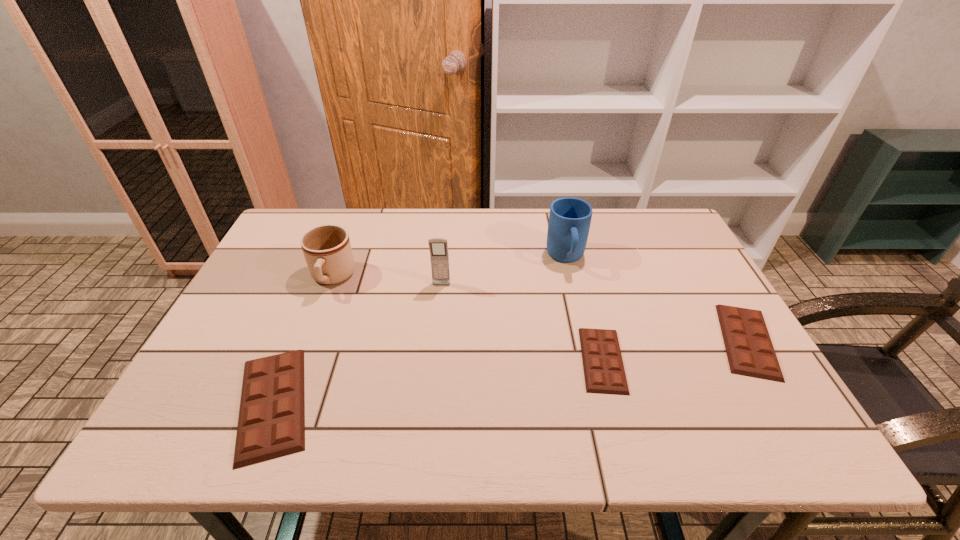
To achieve uniform spacing by inserting another chocolate_bar among them, please point to a free space for this new chocolate_bar. Please provide its 2D coordinates. Your answer should be formatted as a tuple, i.e. [(x, y)], where the tuple contains the x and y coordinates of a point satisfying the conditions above.

[(444, 381)]